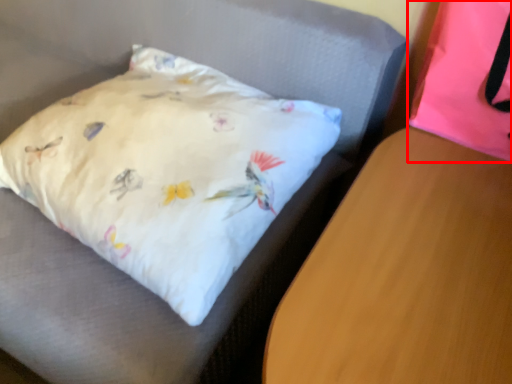
Question: From the image's perspective, where is pillow (annotated by the red box) located in relation to table in the image?

Choices:
 (A) above
 (B) below

Answer: (A)